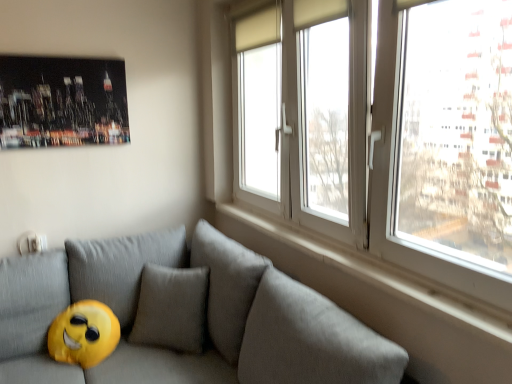
Question: Is white smooth window sill at upper right shorter than shiny metallic poster at upper left?

Choices:
 (A) no
 (B) yes

Answer: (B)

Question: Is white smooth window sill at upper right positioned with its back to shiny metallic poster at upper left?

Choices:
 (A) no
 (B) yes

Answer: (A)

Question: Can you confirm if white smooth window sill at upper right is taller than shiny metallic poster at upper left?

Choices:
 (A) no
 (B) yes

Answer: (A)

Question: Is white smooth window sill at upper right smaller than shiny metallic poster at upper left?

Choices:
 (A) no
 (B) yes

Answer: (B)

Question: Is white smooth window sill at upper right thinner than shiny metallic poster at upper left?

Choices:
 (A) no
 (B) yes

Answer: (A)

Question: Is shiny metallic poster at upper left a part of white smooth window sill at upper right?

Choices:
 (A) no
 (B) yes

Answer: (A)

Question: From the image's perspective, is white plastic window at upper right beneath white smooth window sill at upper right?

Choices:
 (A) no
 (B) yes

Answer: (A)

Question: Is white plastic window at upper right further to the viewer compared to white smooth window sill at upper right?

Choices:
 (A) yes
 (B) no

Answer: (B)

Question: From a real-world perspective, is white plastic window at upper right on top of white smooth window sill at upper right?

Choices:
 (A) no
 (B) yes

Answer: (B)

Question: Is white plastic window at upper right positioned in front of white smooth window sill at upper right?

Choices:
 (A) yes
 (B) no

Answer: (A)

Question: From the image's perspective, is white plastic window at upper right on top of white smooth window sill at upper right?

Choices:
 (A) no
 (B) yes

Answer: (B)

Question: Can you confirm if white plastic window at upper right is wider than white smooth window sill at upper right?

Choices:
 (A) yes
 (B) no

Answer: (A)

Question: Considering the relative positions of white smooth window sill at upper right and gray fabric couch at lower left in the image provided, is white smooth window sill at upper right to the right of gray fabric couch at lower left from the viewer's perspective?

Choices:
 (A) no
 (B) yes

Answer: (B)